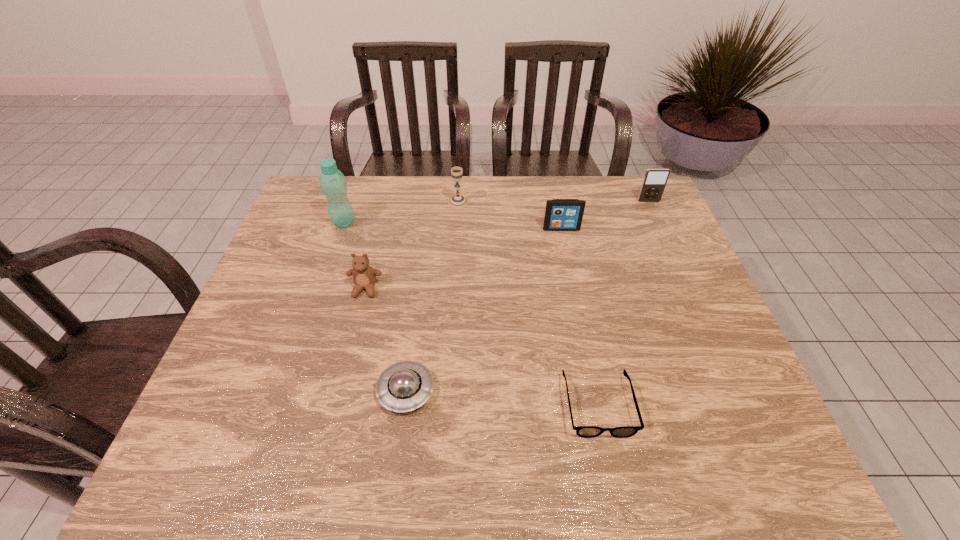
At what (x,y) coordinates should I click in order to perform the action: click on object positioned at the near edge. Please return your answer as a coordinate pair (x, y). This screenshot has width=960, height=540. Looking at the image, I should click on (582, 431).

I want to click on object situated at the left edge, so click(333, 184).

Identify the location of object located in the right edge section of the desktop. The width and height of the screenshot is (960, 540). (655, 180).

The height and width of the screenshot is (540, 960). I want to click on object that is at the far left corner, so click(x=333, y=184).

Identify the location of object at the far right corner. (655, 180).

In the image, there is a desktop. Identify the location of vacant space at the far edge. The height and width of the screenshot is (540, 960). point(404,191).

Where is `free region at the near edge of the desktop`? free region at the near edge of the desktop is located at coordinates (418, 438).

What are the coordinates of `vacant region at the left edge` in the screenshot? It's located at (285, 247).

Where is `vacant space at the right edge of the desktop`? vacant space at the right edge of the desktop is located at coordinates (701, 330).

At what (x,y) coordinates should I click in order to perform the action: click on free space at the far left corner of the desktop. Please return your answer as a coordinate pair (x, y). Looking at the image, I should click on (299, 209).